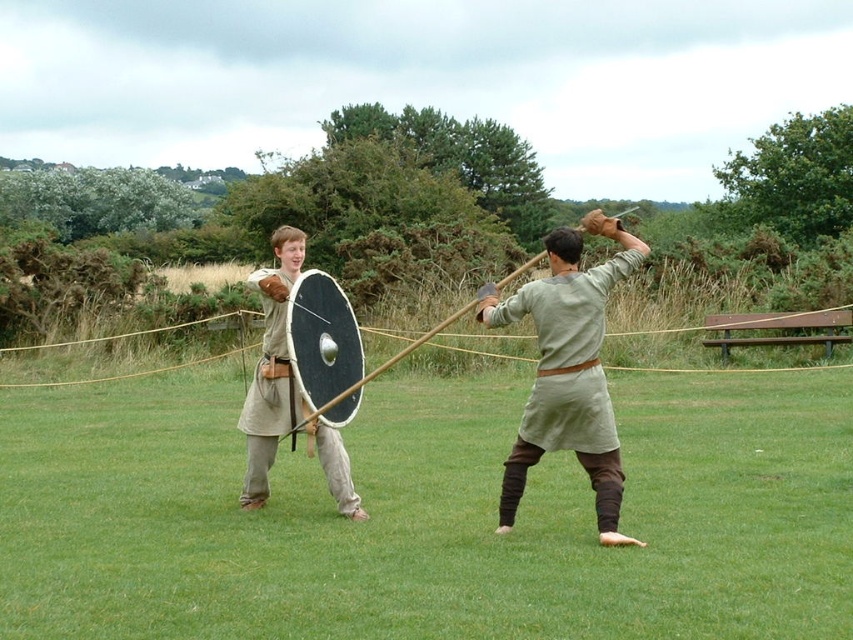
Question: Which of the following is the farthest from the observer?

Choices:
 (A) light beige fabric shield at center
 (B) light gray fabric sword at center

Answer: (A)

Question: Estimate the real-world distances between objects in this image. Which object is farther from the green grass at center?

Choices:
 (A) light beige fabric shield at center
 (B) light gray fabric sword at center

Answer: (A)

Question: Does green grass at center appear over light gray fabric sword at center?

Choices:
 (A) yes
 (B) no

Answer: (B)

Question: Does green grass at center have a lesser width compared to light gray fabric sword at center?

Choices:
 (A) no
 (B) yes

Answer: (A)

Question: Which object is the closest to the light beige fabric shield at center?

Choices:
 (A) green grass at center
 (B) light gray fabric sword at center

Answer: (B)

Question: Can you confirm if light gray fabric sword at center is positioned to the right of light beige fabric shield at center?

Choices:
 (A) yes
 (B) no

Answer: (A)